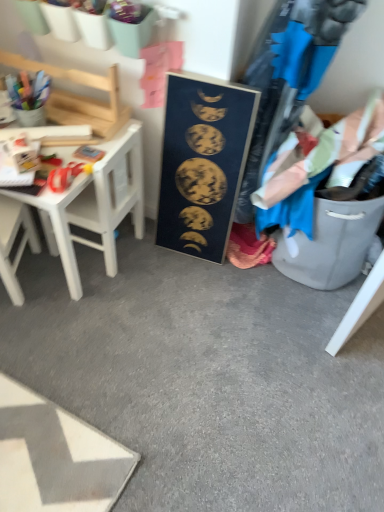
Question: From the image's perspective, is white plastic chair at left on blue cotton shirt at right?

Choices:
 (A) yes
 (B) no

Answer: (B)

Question: Does white plastic chair at left have a greater width compared to blue cotton shirt at right?

Choices:
 (A) yes
 (B) no

Answer: (B)

Question: Can you confirm if white plastic chair at left is shorter than blue cotton shirt at right?

Choices:
 (A) yes
 (B) no

Answer: (B)

Question: Is white plastic chair at left bigger than blue cotton shirt at right?

Choices:
 (A) yes
 (B) no

Answer: (B)

Question: Does white plastic chair at left have a smaller size compared to blue cotton shirt at right?

Choices:
 (A) yes
 (B) no

Answer: (A)

Question: From the image's perspective, is gold metallic moon phases at center positioned above or below blue cotton shirt at right?

Choices:
 (A) below
 (B) above

Answer: (A)

Question: Looking at their shapes, would you say gold metallic moon phases at center is wider or thinner than blue cotton shirt at right?

Choices:
 (A) wide
 (B) thin

Answer: (B)

Question: Does point (218, 212) appear closer or farther from the camera than point (274, 159)?

Choices:
 (A) closer
 (B) farther

Answer: (B)

Question: From their relative heights in the image, would you say gold metallic moon phases at center is taller or shorter than blue cotton shirt at right?

Choices:
 (A) tall
 (B) short

Answer: (A)

Question: Is white wood table at left inside the boundaries of blue cotton shirt at right, or outside?

Choices:
 (A) outside
 (B) inside

Answer: (A)

Question: In terms of width, does white wood table at left look wider or thinner when compared to blue cotton shirt at right?

Choices:
 (A) thin
 (B) wide

Answer: (A)

Question: Considering the positions of point (125, 164) and point (331, 161), is point (125, 164) closer or farther from the camera than point (331, 161)?

Choices:
 (A) farther
 (B) closer

Answer: (A)

Question: From the image's perspective, is white wood table at left located above or below blue cotton shirt at right?

Choices:
 (A) below
 (B) above

Answer: (A)

Question: Choose the correct answer: Is blue cotton shirt at right inside white plastic chair at left or outside it?

Choices:
 (A) inside
 (B) outside

Answer: (B)

Question: Is point (345, 170) positioned closer to the camera than point (13, 223)?

Choices:
 (A) farther
 (B) closer

Answer: (B)